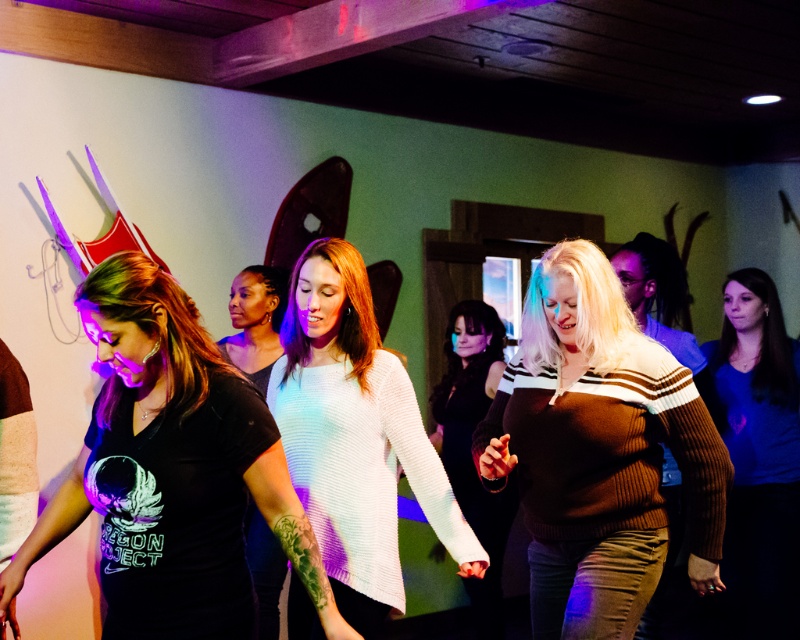
Question: Which of the following is the farthest from the observer?

Choices:
 (A) brown ribbed sweater at center
 (B) dark blue fabric shirt at center
 (C) white knitted sweater at center
 (D) black matte t-shirt at left

Answer: (B)

Question: Can you confirm if white knitted sweater at center is positioned below dark blue fabric shirt at center?

Choices:
 (A) yes
 (B) no

Answer: (A)

Question: Which point is closer to the camera taking this photo?

Choices:
 (A) (61, 492)
 (B) (277, 385)

Answer: (A)

Question: Is black matte t-shirt at left wider than knit sweater at center?

Choices:
 (A) no
 (B) yes

Answer: (B)

Question: Which object appears closest to the camera in this image?

Choices:
 (A) knit sweater at center
 (B) white knitted sweater at center
 (C) brown ribbed sweater at center

Answer: (C)

Question: Is white knitted sweater at center further to camera compared to blue ribbed sweater at lower right?

Choices:
 (A) yes
 (B) no

Answer: (B)